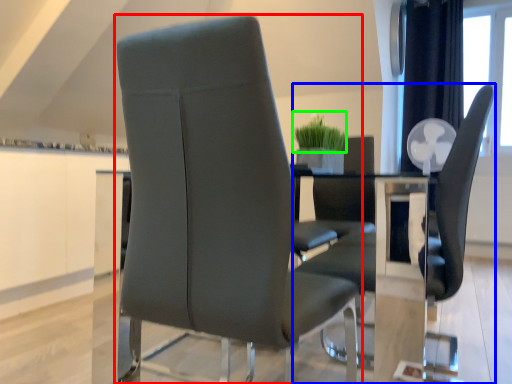
Question: Estimate the real-world distances between objects in this image. Which object is farther from chair (highlighted by a red box), chair (highlighted by a blue box) or plant (highlighted by a green box)?

Choices:
 (A) chair
 (B) plant

Answer: (B)